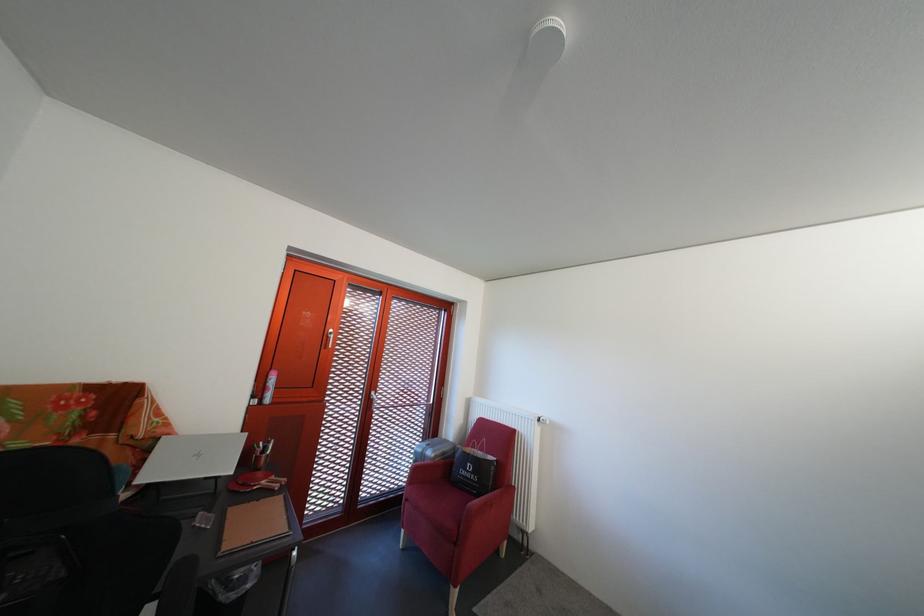
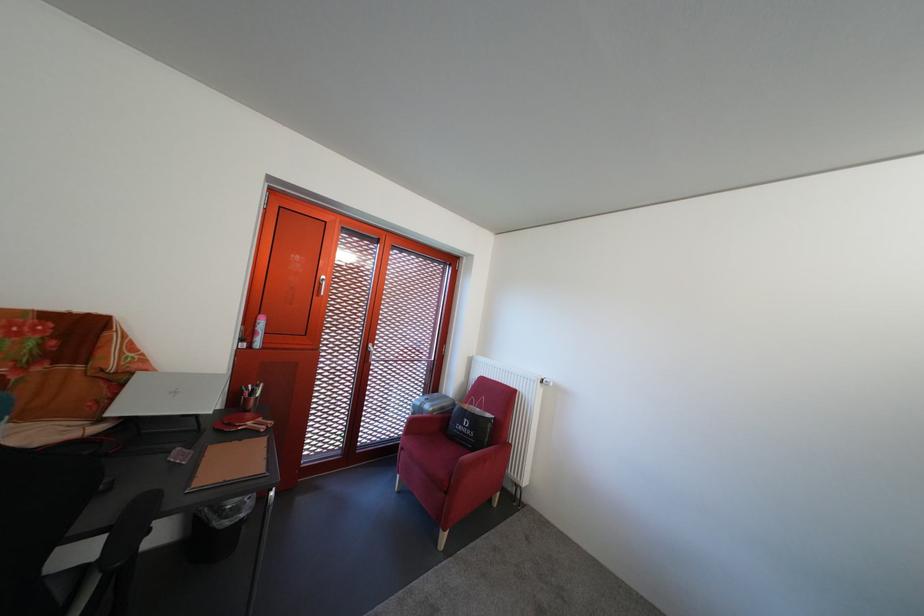
Locate, in the second image, the point that corresponds to (x=271, y=476) in the first image.

(260, 418)